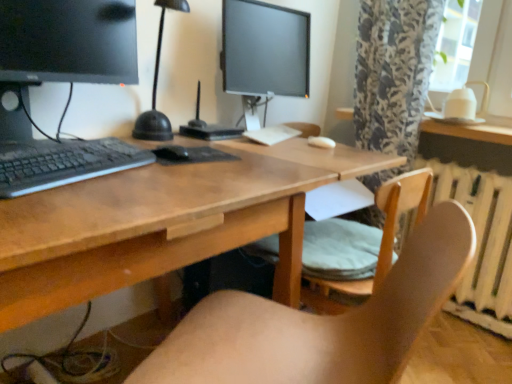
Question: Can you confirm if wooden chair at center, the second chair in the back-to-front sequence, is thinner than black matte mouse at center?

Choices:
 (A) no
 (B) yes

Answer: (A)

Question: Is wooden chair at center, the 1th chair when ordered from front to back, at the left side of black matte mouse at center?

Choices:
 (A) yes
 (B) no

Answer: (B)

Question: Is wooden chair at center, the 1th chair when ordered from front to back, oriented away from black matte mouse at center?

Choices:
 (A) yes
 (B) no

Answer: (B)

Question: Is wooden chair at center, the 1th chair when ordered from front to back, smaller than black matte mouse at center?

Choices:
 (A) yes
 (B) no

Answer: (B)

Question: Considering the relative sizes of wooden chair at center, the second chair in the back-to-front sequence, and black matte mouse at center in the image provided, is wooden chair at center, the second chair in the back-to-front sequence, bigger than black matte mouse at center?

Choices:
 (A) yes
 (B) no

Answer: (A)

Question: Considering the relative sizes of wooden chair at center, the 1th chair when ordered from front to back, and black matte mouse at center in the image provided, is wooden chair at center, the 1th chair when ordered from front to back, shorter than black matte mouse at center?

Choices:
 (A) yes
 (B) no

Answer: (B)

Question: Is black matte mouse at center to the right of white glossy table at upper right from the viewer's perspective?

Choices:
 (A) no
 (B) yes

Answer: (A)

Question: Is black matte mouse at center aimed at white glossy table at upper right?

Choices:
 (A) no
 (B) yes

Answer: (A)

Question: Is black matte mouse at center shorter than white glossy table at upper right?

Choices:
 (A) yes
 (B) no

Answer: (A)

Question: From the image's perspective, is black matte mouse at center on white glossy table at upper right?

Choices:
 (A) no
 (B) yes

Answer: (A)

Question: From the image's perspective, would you say black matte mouse at center is shown under white glossy table at upper right?

Choices:
 (A) yes
 (B) no

Answer: (A)

Question: Is black matte mouse at center not within white glossy table at upper right?

Choices:
 (A) yes
 (B) no

Answer: (A)

Question: From a real-world perspective, is wooden chair at center, the 1th chair when ordered from front to back, positioned under wooden desk at center based on gravity?

Choices:
 (A) yes
 (B) no

Answer: (B)